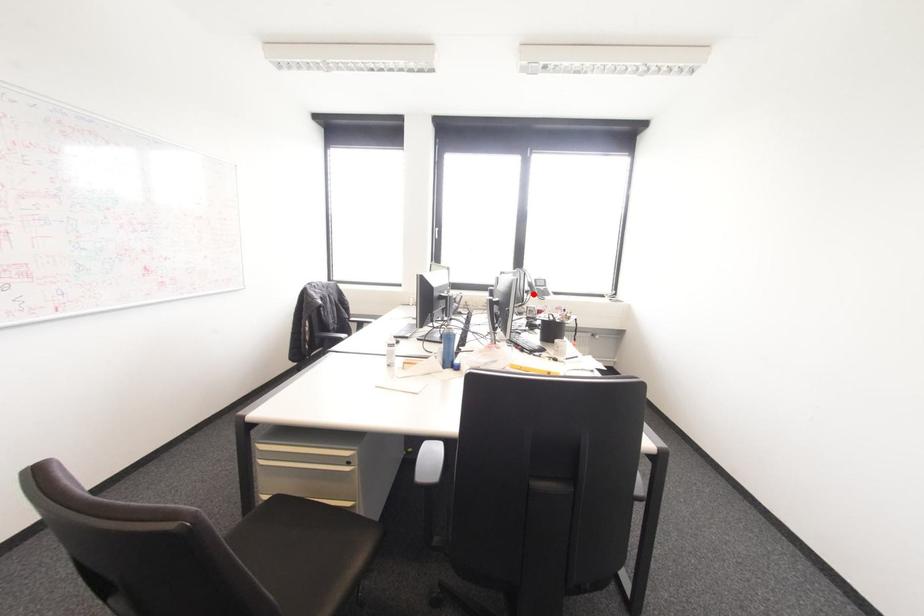
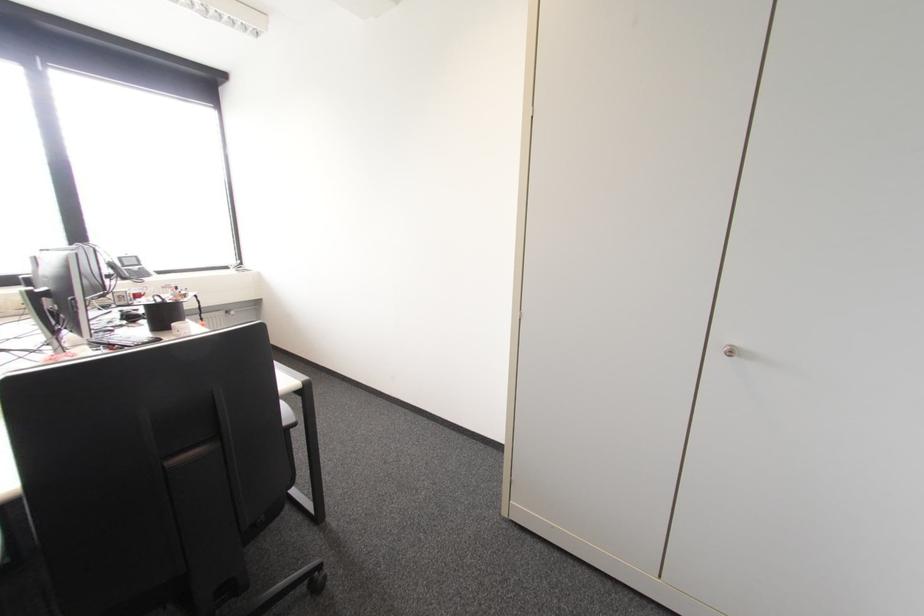
Find the pixel in the second image that matches the highlighted location in the first image.

(123, 278)